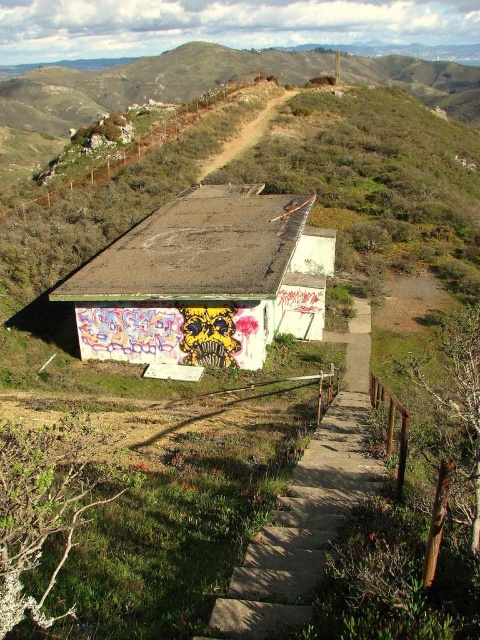
Find the location of `rusty metal hut at center`. rusty metal hut at center is located at coordinates (204, 280).

Does point (218, 220) come in front of point (257, 630)?

No.

Image resolution: width=480 pixels, height=640 pixels. I want to click on rusty metal hut at center, so click(204, 280).